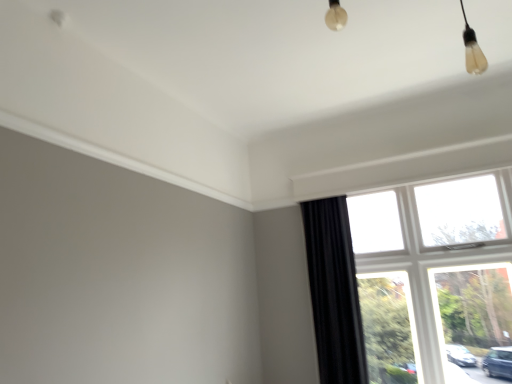
Question: Visually, is black velvet curtain at right positioned to the left or to the right of white plastic window at right?

Choices:
 (A) left
 (B) right

Answer: (A)

Question: From the image's perspective, is black velvet curtain at right positioned above or below white plastic window at right?

Choices:
 (A) below
 (B) above

Answer: (A)

Question: Is black velvet curtain at right bigger or smaller than white plastic window at right?

Choices:
 (A) small
 (B) big

Answer: (A)

Question: In terms of width, does white plastic window at right look wider or thinner when compared to black velvet curtain at right?

Choices:
 (A) thin
 (B) wide

Answer: (A)

Question: Looking at the image, does white plastic window at right seem bigger or smaller compared to black velvet curtain at right?

Choices:
 (A) big
 (B) small

Answer: (A)

Question: From the image's perspective, is white plastic window at right positioned above or below black velvet curtain at right?

Choices:
 (A) above
 (B) below

Answer: (A)

Question: Is white plastic window at right situated inside black velvet curtain at right or outside?

Choices:
 (A) inside
 (B) outside

Answer: (B)